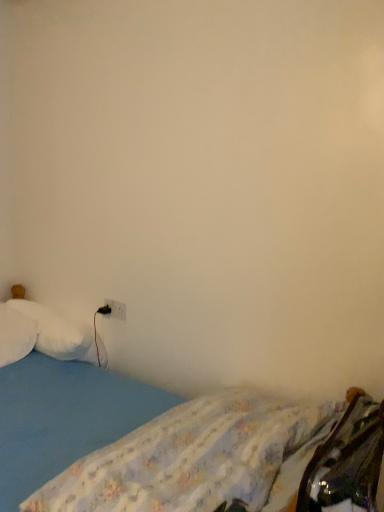
Question: Is blue fabric bed at lower left located within white plastic electric outlet at lower left?

Choices:
 (A) no
 (B) yes

Answer: (A)

Question: Is white plastic electric outlet at lower left shorter than blue fabric bed at lower left?

Choices:
 (A) no
 (B) yes

Answer: (B)

Question: Considering the relative positions of white plastic electric outlet at lower left and blue fabric bed at lower left in the image provided, is white plastic electric outlet at lower left in front of blue fabric bed at lower left?

Choices:
 (A) yes
 (B) no

Answer: (B)

Question: From a real-world perspective, is white plastic electric outlet at lower left physically below blue fabric bed at lower left?

Choices:
 (A) yes
 (B) no

Answer: (B)

Question: Does white plastic electric outlet at lower left have a lesser width compared to blue fabric bed at lower left?

Choices:
 (A) yes
 (B) no

Answer: (A)

Question: Is point (119, 305) positioned closer to the camera than point (6, 307)?

Choices:
 (A) closer
 (B) farther

Answer: (A)

Question: From a real-world perspective, is white plastic electric outlet at lower left positioned above or below white fluffy pillow at left, which ranks as the 1th pillow in left-to-right order?

Choices:
 (A) below
 (B) above

Answer: (B)

Question: Considering the relative positions of white plastic electric outlet at lower left and white fluffy pillow at left, which ranks as the 1th pillow in left-to-right order, in the image provided, is white plastic electric outlet at lower left to the left or to the right of white fluffy pillow at left, which ranks as the 1th pillow in left-to-right order,?

Choices:
 (A) left
 (B) right

Answer: (B)

Question: From the image's perspective, is white plastic electric outlet at lower left positioned above or below white fluffy pillow at left, which ranks as the 1th pillow in left-to-right order?

Choices:
 (A) above
 (B) below

Answer: (A)

Question: Do you think blue fabric mattress at lower left is within white plastic electric outlet at lower left, or outside of it?

Choices:
 (A) outside
 (B) inside

Answer: (A)

Question: Is blue fabric mattress at lower left in front of or behind white plastic electric outlet at lower left in the image?

Choices:
 (A) front
 (B) behind

Answer: (A)

Question: Is blue fabric mattress at lower left bigger or smaller than white plastic electric outlet at lower left?

Choices:
 (A) big
 (B) small

Answer: (A)

Question: Is point (150, 508) closer or farther from the camera than point (110, 300)?

Choices:
 (A) farther
 (B) closer

Answer: (B)

Question: From the image's perspective, relative to blue fabric bed at lower left, is white fluffy pillow at left, which is counted as the 2th pillow, starting from the right, above or below?

Choices:
 (A) above
 (B) below

Answer: (A)

Question: Is white fluffy pillow at left, which is counted as the 2th pillow, starting from the right, bigger or smaller than blue fabric bed at lower left?

Choices:
 (A) small
 (B) big

Answer: (A)